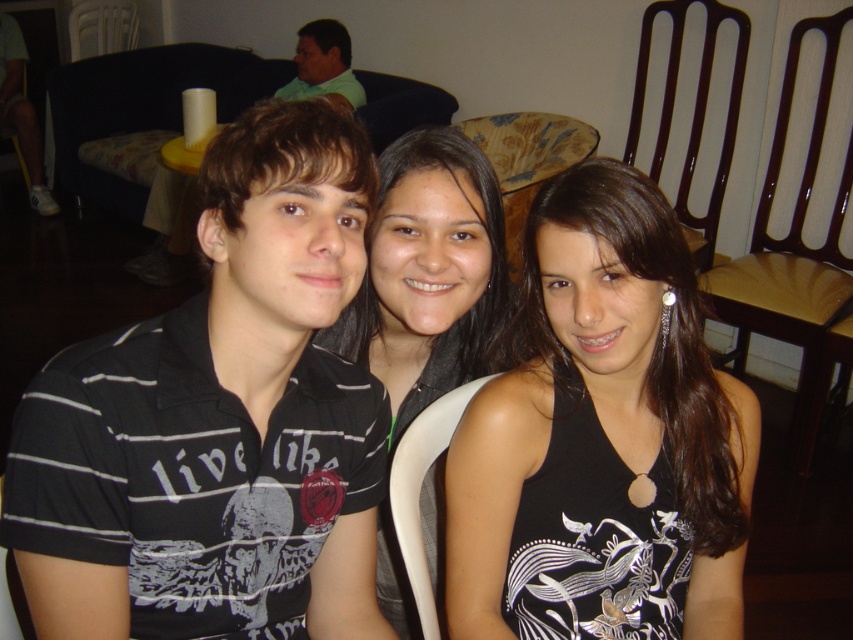
Question: Which point is farther from the camera taking this photo?

Choices:
 (A) (328, 573)
 (B) (126, 4)

Answer: (B)

Question: Observing the image, what is the correct spatial positioning of white plastic chair at center in reference to white matte shoe at lower left?

Choices:
 (A) above
 (B) below

Answer: (B)

Question: Does black striped polo shirt at left have a larger size compared to green matte shirt at upper left?

Choices:
 (A) no
 (B) yes

Answer: (A)

Question: Which point is closer to the camera taking this photo?

Choices:
 (A) (254, 292)
 (B) (701, 1)
 (C) (51, 212)
 (D) (447, 403)

Answer: (A)

Question: Where is black striped polo shirt at left located in relation to green matte shirt at upper left in the image?

Choices:
 (A) below
 (B) above

Answer: (A)

Question: Estimate the real-world distances between objects in this image. Which object is closer to the brown wood chair at right?

Choices:
 (A) patterned fabric chair at center
 (B) dark brown wooden chair at right
 (C) black striped polo shirt at left

Answer: (B)